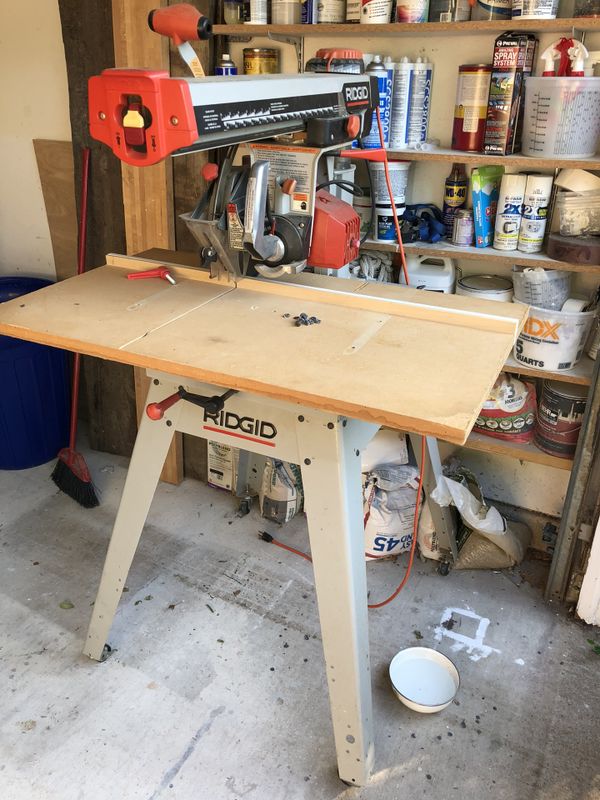
The image size is (600, 800). I want to click on plastic spray bottles, so click(578, 58), click(548, 61).